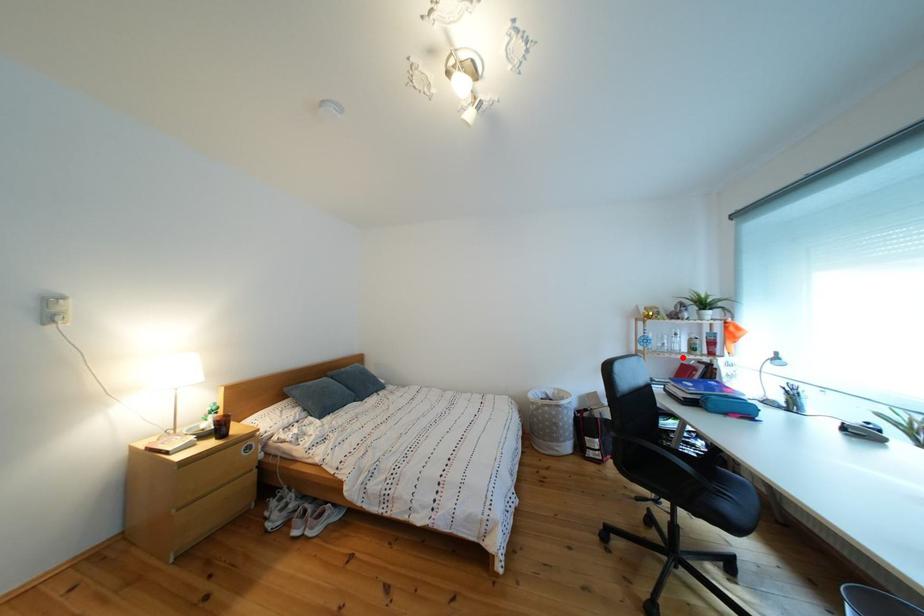
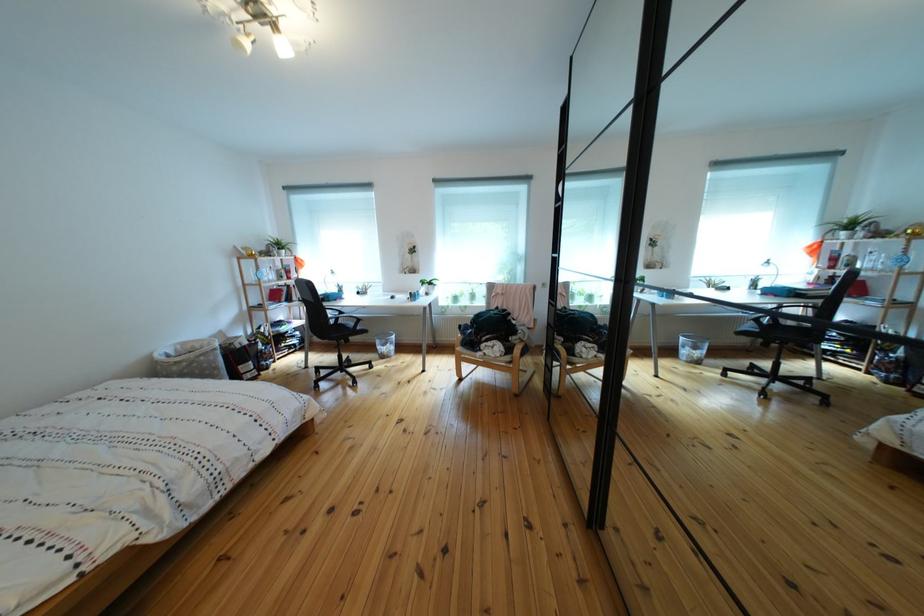
The point at the highlighted location is marked in the first image. Where is the corresponding point in the second image?

(282, 286)